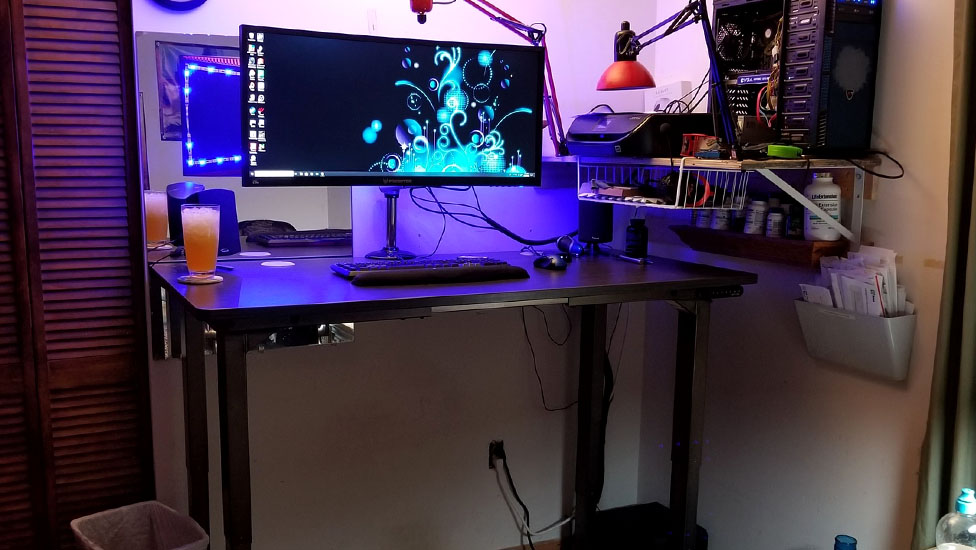
Where is `desk`? The image size is (976, 550). desk is located at coordinates (433, 280).